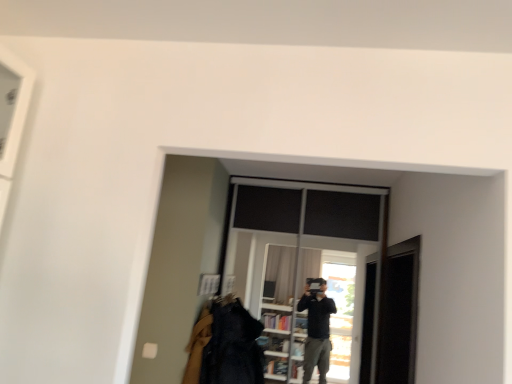
Question: From a real-world perspective, is transparent glass screen door at right located beneath transparent glass window at center?

Choices:
 (A) no
 (B) yes

Answer: (B)

Question: Is the depth of transparent glass screen door at right greater than that of transparent glass window at center?

Choices:
 (A) yes
 (B) no

Answer: (B)

Question: Is transparent glass screen door at right positioned beyond the bounds of transparent glass window at center?

Choices:
 (A) no
 (B) yes

Answer: (B)

Question: From the image's perspective, is transparent glass screen door at right over transparent glass window at center?

Choices:
 (A) yes
 (B) no

Answer: (B)

Question: From a real-world perspective, is transparent glass screen door at right physically above transparent glass window at center?

Choices:
 (A) no
 (B) yes

Answer: (A)

Question: Considering the relative sizes of transparent glass screen door at right and transparent glass window at center in the image provided, is transparent glass screen door at right smaller than transparent glass window at center?

Choices:
 (A) yes
 (B) no

Answer: (A)

Question: From the image's perspective, would you say transparent glass window at center is positioned over denim jacket at lower center?

Choices:
 (A) no
 (B) yes

Answer: (B)

Question: From a real-world perspective, is transparent glass window at center physically above denim jacket at lower center?

Choices:
 (A) no
 (B) yes

Answer: (B)

Question: Can you confirm if transparent glass window at center is shorter than denim jacket at lower center?

Choices:
 (A) no
 (B) yes

Answer: (A)

Question: Considering the relative sizes of transparent glass window at center and denim jacket at lower center in the image provided, is transparent glass window at center taller than denim jacket at lower center?

Choices:
 (A) yes
 (B) no

Answer: (A)

Question: From a real-world perspective, is transparent glass window at center positioned under denim jacket at lower center based on gravity?

Choices:
 (A) no
 (B) yes

Answer: (A)

Question: Can you confirm if transparent glass window at center is positioned to the right of denim jacket at lower center?

Choices:
 (A) yes
 (B) no

Answer: (A)

Question: From the image's perspective, would you say denim jacket at lower center is shown under transparent glass screen door at right?

Choices:
 (A) yes
 (B) no

Answer: (A)